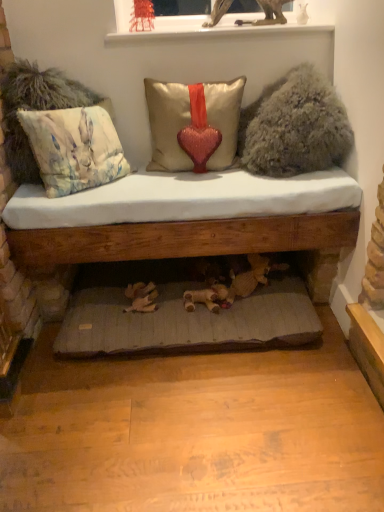
Where is `vacant space in front of wooden bed frame at lower center`? The height and width of the screenshot is (512, 384). vacant space in front of wooden bed frame at lower center is located at coordinates (193, 425).